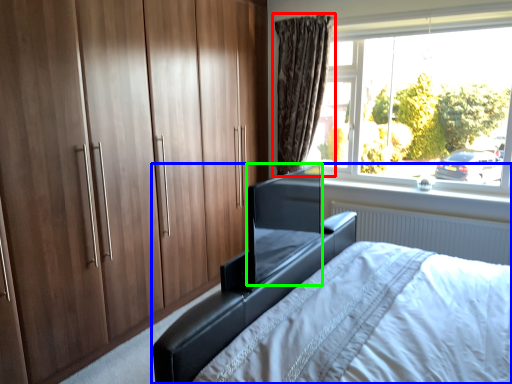
Question: Estimate the real-world distances between objects in this image. Which object is farther from curtain (highlighted by a red box), bed (highlighted by a blue box) or window screen (highlighted by a green box)?

Choices:
 (A) bed
 (B) window screen

Answer: (B)